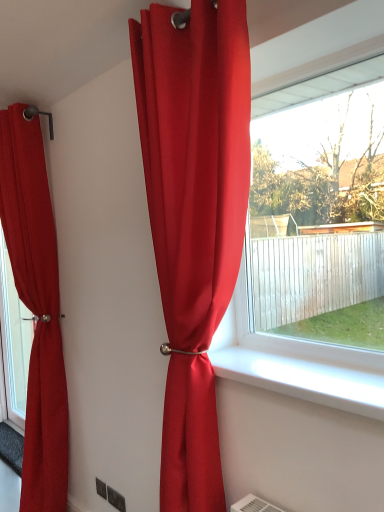
Question: From the image's perspective, would you say white smooth window sill at center is shown under matte red curtain at center, marked as the 2th curtain in a left-to-right arrangement?

Choices:
 (A) yes
 (B) no

Answer: (A)

Question: Considering the relative sizes of white smooth window sill at center and matte red curtain at center, marked as the second curtain in a back-to-front arrangement, in the image provided, is white smooth window sill at center taller than matte red curtain at center, marked as the second curtain in a back-to-front arrangement,?

Choices:
 (A) no
 (B) yes

Answer: (A)

Question: Is there a large distance between white smooth window sill at center and matte red curtain at center, marked as the second curtain in a back-to-front arrangement?

Choices:
 (A) no
 (B) yes

Answer: (A)

Question: Is the depth of white smooth window sill at center less than that of matte red curtain at center, marked as the second curtain in a back-to-front arrangement?

Choices:
 (A) yes
 (B) no

Answer: (A)

Question: Can you confirm if white smooth window sill at center is bigger than matte red curtain at center, the 1th curtain when ordered from right to left?

Choices:
 (A) yes
 (B) no

Answer: (B)

Question: Does white smooth window sill at center appear on the left side of matte red curtain at center, the 1th curtain when ordered from right to left?

Choices:
 (A) no
 (B) yes

Answer: (A)

Question: Can you confirm if matte red curtain at center, marked as the 2th curtain in a left-to-right arrangement, is wider than white smooth window sill at center?

Choices:
 (A) no
 (B) yes

Answer: (A)

Question: Does matte red curtain at center, placed as the first curtain when sorted from front to back, have a lesser width compared to white smooth window sill at center?

Choices:
 (A) no
 (B) yes

Answer: (B)

Question: Can white smooth window sill at center be found inside matte red curtain at center, the 1th curtain when ordered from right to left?

Choices:
 (A) yes
 (B) no

Answer: (B)

Question: Considering the relative sizes of matte red curtain at center, marked as the 2th curtain in a left-to-right arrangement, and white smooth window sill at center in the image provided, is matte red curtain at center, marked as the 2th curtain in a left-to-right arrangement, bigger than white smooth window sill at center?

Choices:
 (A) no
 (B) yes

Answer: (B)

Question: Is the position of matte red curtain at center, marked as the 2th curtain in a left-to-right arrangement, less distant than that of white smooth window sill at center?

Choices:
 (A) no
 (B) yes

Answer: (A)

Question: Is matte red curtain at center, the 1th curtain when ordered from right to left, taller than white smooth window sill at center?

Choices:
 (A) yes
 (B) no

Answer: (A)

Question: Is matte red curtain at center, the 1th curtain when ordered from right to left, behind matte red curtain at left, which is counted as the second curtain, starting from the front?

Choices:
 (A) no
 (B) yes

Answer: (A)